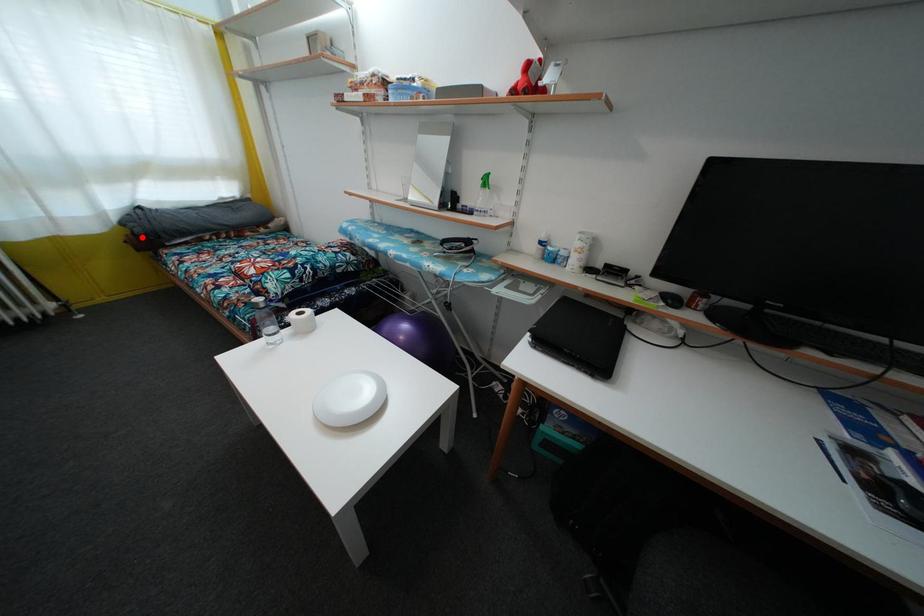
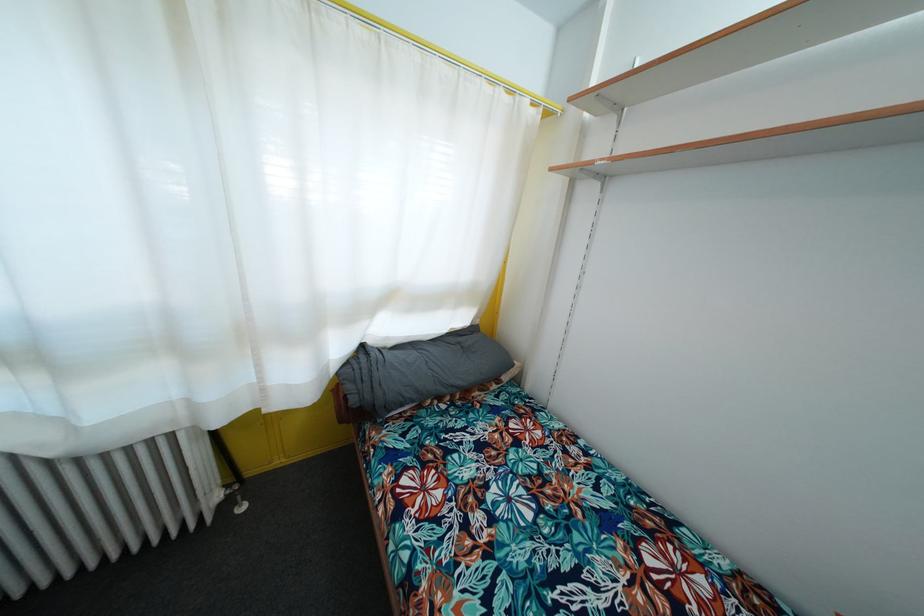
Question: I am providing you with two images of the same scene from different viewpoints. A red point is marked on the first image. Is the red point's position out of view in image 2?

Choices:
 (A) Yes
 (B) No

Answer: (B)